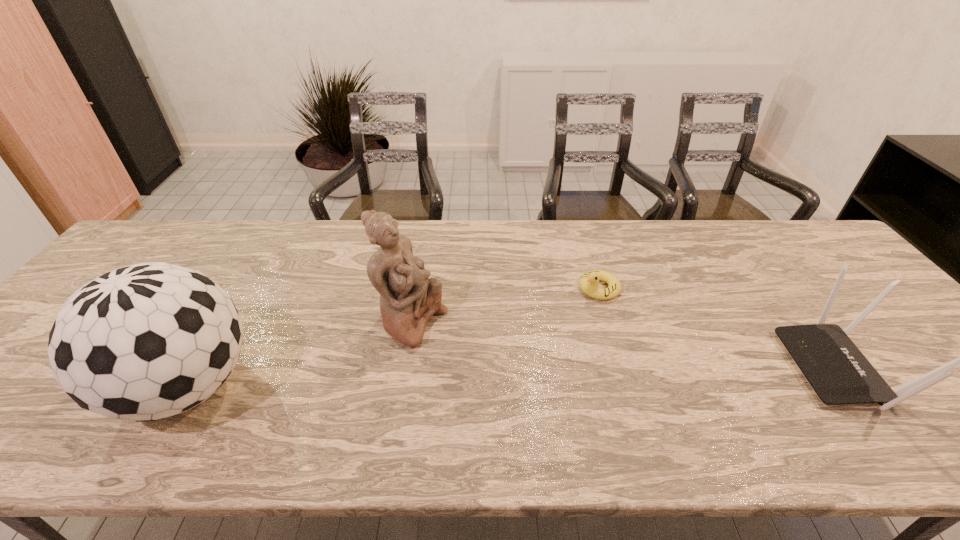
Identify the location of empty location between the router and the shortest object. Image resolution: width=960 pixels, height=540 pixels. (719, 328).

You are a GUI agent. You are given a task and a screenshot of the screen. Output one action in this format:
    pyautogui.click(x=<x>, y=<y>)
    Task: Click on the free space between the shortest object and the third object from right to left
    
    Given the screenshot: What is the action you would take?
    pyautogui.click(x=506, y=305)

Locate which object ranks third in proximity to the leftmost object. Please provide its 2D coordinates. Your answer should be formatted as a tuple, i.e. [(x, y)], where the tuple contains the x and y coordinates of a point satisfying the conditions above.

[(838, 372)]

The image size is (960, 540). What are the coordinates of `the second closest object to the duckling` in the screenshot? It's located at (408, 299).

At what (x,y) coordinates should I click in order to perform the action: click on blank space that satisfies the following two spatial constraints: 1. on the front side of the router; 2. on the front-facing side of the duckling. Please return your answer as a coordinate pair (x, y). Looking at the image, I should click on (623, 368).

Locate an element on the screen. The height and width of the screenshot is (540, 960). free space that satisfies the following two spatial constraints: 1. on the front side of the router; 2. on the front-facing side of the third object from left to right is located at coordinates (623, 368).

Where is `free region that satisfies the following two spatial constraints: 1. on the front side of the shortest object; 2. on the front-facing side of the third tallest object`? This screenshot has height=540, width=960. free region that satisfies the following two spatial constraints: 1. on the front side of the shortest object; 2. on the front-facing side of the third tallest object is located at coordinates (623, 368).

This screenshot has width=960, height=540. Find the location of `free spot that satisfies the following two spatial constraints: 1. on the front side of the router; 2. on the front-facing side of the duckling`. free spot that satisfies the following two spatial constraints: 1. on the front side of the router; 2. on the front-facing side of the duckling is located at coordinates (623, 368).

Find the location of a particular element. Image resolution: width=960 pixels, height=540 pixels. vacant space that satisfies the following two spatial constraints: 1. on the front side of the second shortest object; 2. on the front-facing side of the duckling is located at coordinates (623, 368).

Where is `vacant space that satisfies the following two spatial constraints: 1. on the front side of the rightmost object; 2. on the front-facing side of the figurine`? The width and height of the screenshot is (960, 540). vacant space that satisfies the following two spatial constraints: 1. on the front side of the rightmost object; 2. on the front-facing side of the figurine is located at coordinates (405, 368).